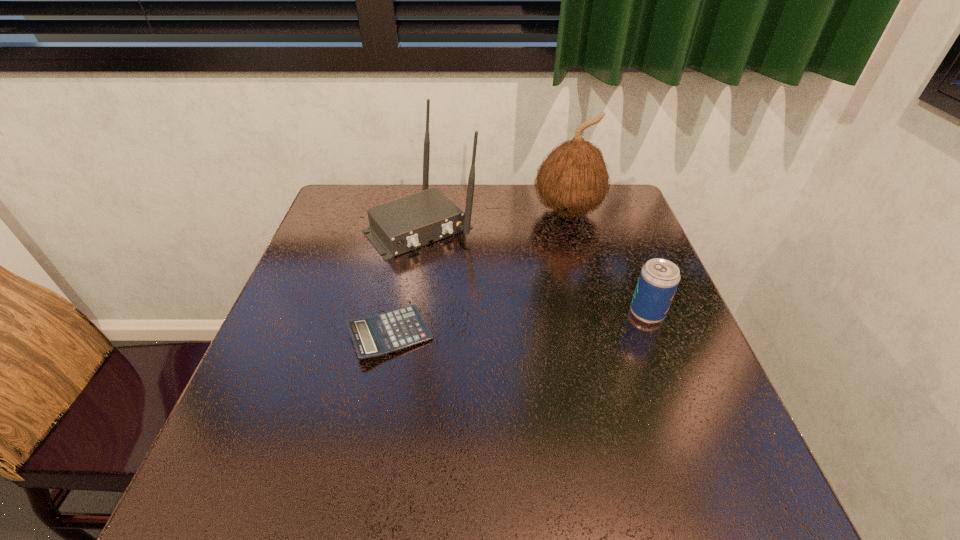
Locate an element on the screen. This screenshot has height=540, width=960. the shortest object is located at coordinates (381, 334).

What are the coordinates of `the second shortest object` in the screenshot? It's located at (659, 278).

Locate an element on the screen. The image size is (960, 540). router is located at coordinates (398, 226).

Find the location of a particular element. The height and width of the screenshot is (540, 960). coconut is located at coordinates (573, 179).

Where is `vacant region located on the right of the calculator`? The height and width of the screenshot is (540, 960). vacant region located on the right of the calculator is located at coordinates (615, 334).

Locate an element on the screen. Image resolution: width=960 pixels, height=540 pixels. free point located 0.290m on the back of the third tallest object is located at coordinates (614, 227).

Image resolution: width=960 pixels, height=540 pixels. What are the coordinates of `vacant point located on the back of the router to connect cables` in the screenshot? It's located at (503, 312).

Find the location of `blank area located on the back of the router to connect cables`. blank area located on the back of the router to connect cables is located at coordinates (474, 281).

Find the location of `vacant region located on the back of the router to connect cables`. vacant region located on the back of the router to connect cables is located at coordinates (508, 317).

The width and height of the screenshot is (960, 540). Identify the location of vacant space located on the surface of the coconut. (564, 243).